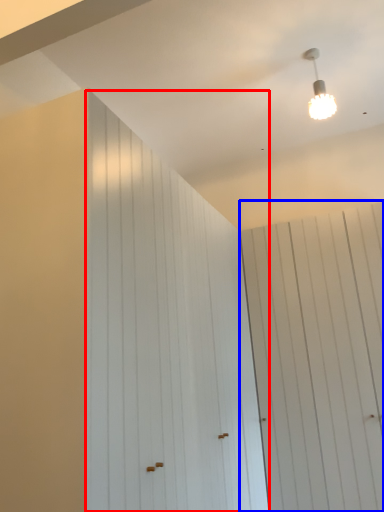
Question: Which object is closer to the camera taking this photo, barn door (highlighted by a red box) or barn door (highlighted by a blue box)?

Choices:
 (A) barn door
 (B) barn door

Answer: (A)